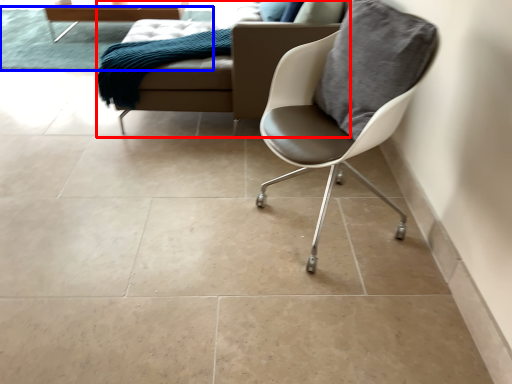
Question: Which point is closer to the camera, studio couch (highlighted by a red box) or mat (highlighted by a blue box)?

Choices:
 (A) studio couch
 (B) mat

Answer: (A)